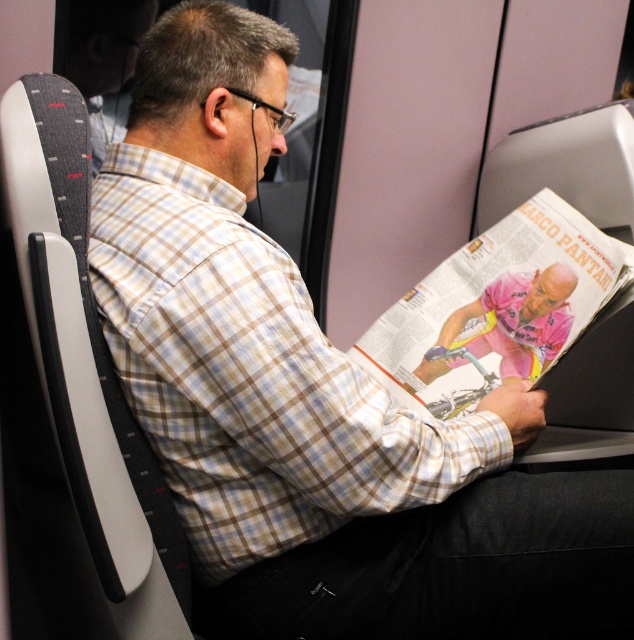
You are a fashion designer observing the scene. You need to decide which item to focus on first for a detailed analysis. Which item is bigger in size between the checkered fabric shirt at center and the pink fabric magazine at center?

The checkered fabric shirt at center has a larger size compared to the pink fabric magazine at center, so you should focus on the checkered fabric shirt at center first for detailed analysis.

You are a photographer standing at the back of the train or bus. You want to take a photo of the man wearing the black denim pants at lower center and the pink jersey cyclist at center from the newspaper. Can you fit both subjects in the frame if your camera has a 12 inch wide field of view?

The black denim pants at lower center and pink jersey cyclist at center are 12.81 inches apart. Since the distance between them exceeds the camera field of view by 0.81 inches, you cannot fit both subjects in the frame.